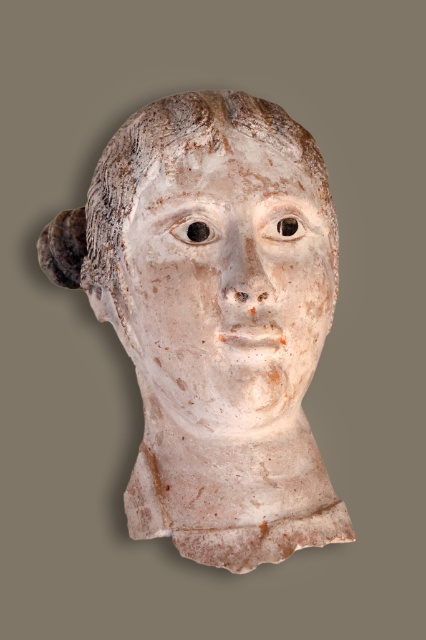
You are an art restorer examining the white marble bust at center and the white clay face at center. Which object is closer to you?

The white marble bust at center is closer to you than the white clay face at center.

You are an art conservator examining two sculptures in a museum. You have a storage box that can only accommodate items up to 40 cm in width. You need to store the white marble bust at center and the white clay face at center. Based on their widths, which one might not fit in the box and why?

The white marble bust at center might not fit in the box because its width is larger than the white clay face at center, and the box can only hold items up to 40 cm. If the marble bust exceeds 40 cm, it won would fit.

You are an archaeologist examining a fragmented sculpture. You notice a point marked at coordinates [215,320]. Based on the scene description, what object is located at that point?

The point at coordinates [215,320] indicates the white marble bust at center.